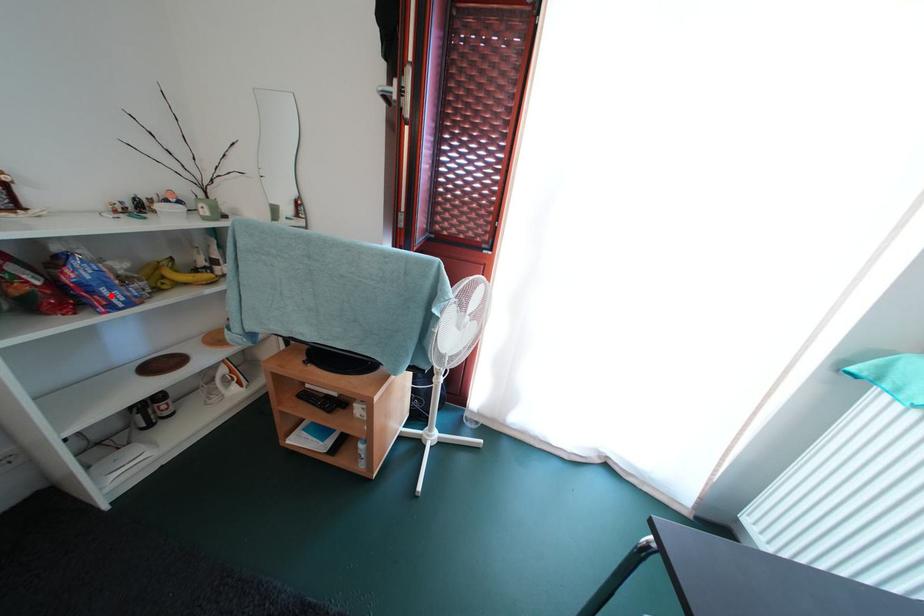
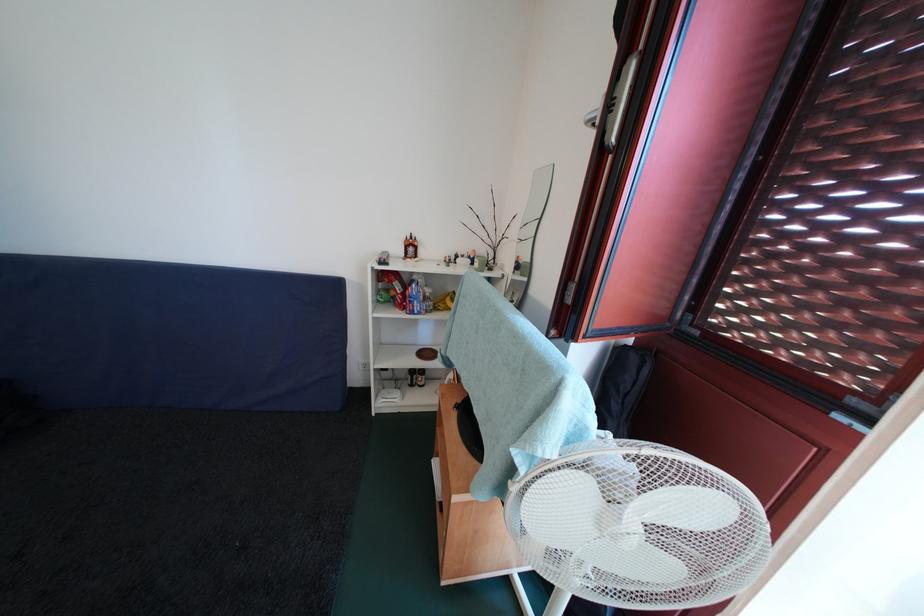
In the second image, find the point that corresponds to the highlighted location in the first image.

(422, 307)